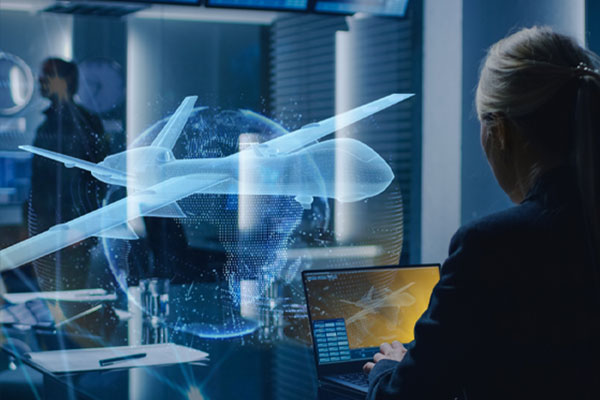
The height and width of the screenshot is (400, 600). In order to click on laptop screen in this screenshot , I will do `click(390, 306)`.